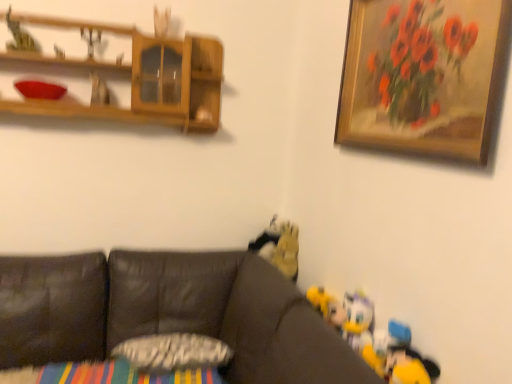
Identify the location of wooden shelf at upper left. (140, 78).

What do you see at coordinates (140, 78) in the screenshot?
I see `wooden shelf at upper left` at bounding box center [140, 78].

This screenshot has height=384, width=512. In order to click on matte plastic toy at upper left, which appears as the 5th toy when ordered from the bottom in this screenshot , I will do `click(91, 40)`.

The height and width of the screenshot is (384, 512). What do you see at coordinates (279, 247) in the screenshot? I see `fluffy yellow toy at center, which is the fourth toy from left to right` at bounding box center [279, 247].

At what (x,y) coordinates should I click in order to perform the action: click on brown leather couch at lower left. Please return your answer as a coordinate pair (x, y). Looking at the image, I should click on (169, 313).

The height and width of the screenshot is (384, 512). What do you see at coordinates (406, 358) in the screenshot?
I see `yellow plush toy at lower right, arranged as the 1th toy when viewed from the right` at bounding box center [406, 358].

Find the location of a particular element. The height and width of the screenshot is (384, 512). yellow plush toy at lower right, which is counted as the 6th toy, starting from the left is located at coordinates (406, 358).

Identify the location of metallic silver toy at upper left, marked as the 4th toy in a bottom-to-top arrangement. This screenshot has width=512, height=384. (99, 91).

Find the location of a particular element. This screenshot has width=512, height=384. wooden shelf at upper left is located at coordinates (140, 78).

From the image's perspective, would you say plush yellow duck at lower right, the 2th toy positioned from the right, is positioned over fluffy yellow toy at center, which is counted as the 6th toy, starting from the front?

No.

Is fluffy yellow toy at center, which is counted as the 6th toy, starting from the front, a part of plush yellow duck at lower right, which is the 5th toy in left-to-right order?

Actually, fluffy yellow toy at center, which is counted as the 6th toy, starting from the front, is outside plush yellow duck at lower right, which is the 5th toy in left-to-right order.

Visually, is plush yellow duck at lower right, positioned as the second toy in front-to-back order, positioned to the left or to the right of fluffy yellow toy at center, which is counted as the 6th toy, starting from the front?

In the image, plush yellow duck at lower right, positioned as the second toy in front-to-back order, appears on the right side of fluffy yellow toy at center, which is counted as the 6th toy, starting from the front.

Considering the sizes of matte plastic toy at upper left, marked as the 3th toy in a back-to-front arrangement, and wooden shelf at upper left in the image, is matte plastic toy at upper left, marked as the 3th toy in a back-to-front arrangement, bigger or smaller than wooden shelf at upper left?

Clearly, matte plastic toy at upper left, marked as the 3th toy in a back-to-front arrangement, is smaller in size than wooden shelf at upper left.

Considering the relative positions of matte plastic toy at upper left, the 4th toy viewed from the front, and wooden shelf at upper left in the image provided, is matte plastic toy at upper left, the 4th toy viewed from the front, to the left or to the right of wooden shelf at upper left?

matte plastic toy at upper left, the 4th toy viewed from the front, is positioned on wooden shelf at upper left's left side.

Considering the points (92, 48) and (47, 19), which point is in front, point (92, 48) or point (47, 19)?

The point (47, 19) is closer to the camera.

Which object is closer to the camera taking this photo, matte plastic toy at upper left, marked as the 3th toy in a back-to-front arrangement, or brown leather couch at lower left?

Positioned in front is brown leather couch at lower left.

From a real-world perspective, who is located lower, matte plastic toy at upper left, marked as the 3th toy in a back-to-front arrangement, or brown leather couch at lower left?

From a 3D spatial view, brown leather couch at lower left is below.

Considering the sizes of objects matte plastic toy at upper left, marked as the 3th toy in a back-to-front arrangement, and brown leather couch at lower left in the image provided, who is shorter, matte plastic toy at upper left, marked as the 3th toy in a back-to-front arrangement, or brown leather couch at lower left?

Standing shorter between the two is matte plastic toy at upper left, marked as the 3th toy in a back-to-front arrangement.

Is the surface of matte plastic toy at upper left, the second toy positioned from the top, in direct contact with brown leather couch at lower left?

No, matte plastic toy at upper left, the second toy positioned from the top, is not touching brown leather couch at lower left.

Is green felt toy at upper left, arranged as the 1th toy when viewed from the top, facing towards plush yellow duck at lower right, the second toy when ordered from bottom to top?

No, green felt toy at upper left, arranged as the 1th toy when viewed from the top, is not oriented towards plush yellow duck at lower right, the second toy when ordered from bottom to top.

Could you measure the distance between green felt toy at upper left, the third toy in the front-to-back sequence, and plush yellow duck at lower right, positioned as the second toy in front-to-back order?

6.05 feet.

Is green felt toy at upper left, the fourth toy from the back, next to plush yellow duck at lower right, which is the 5th toy in left-to-right order, and touching it?

No, green felt toy at upper left, the fourth toy from the back, is not making contact with plush yellow duck at lower right, which is the 5th toy in left-to-right order.

From the picture: Can you confirm if green felt toy at upper left, the third toy in the front-to-back sequence, is taller than plush yellow duck at lower right, the 2th toy positioned from the right?

No.

From a real-world perspective, is brown leather couch at lower left positioned above or below metallic silver toy at upper left, the fifth toy when ordered from front to back?

brown leather couch at lower left is situated lower than metallic silver toy at upper left, the fifth toy when ordered from front to back, in the real world.

Considering the relative sizes of brown leather couch at lower left and metallic silver toy at upper left, marked as the 4th toy in a bottom-to-top arrangement, in the image provided, is brown leather couch at lower left bigger than metallic silver toy at upper left, marked as the 4th toy in a bottom-to-top arrangement,?

Correct, brown leather couch at lower left is larger in size than metallic silver toy at upper left, marked as the 4th toy in a bottom-to-top arrangement.

Is point (356, 358) in front of point (96, 88)?

Yes, it is.

Between yellow plush toy at lower right, the first toy viewed from the front, and matte plastic toy at upper left, the 4th toy viewed from the front, which one is positioned in front?

yellow plush toy at lower right, the first toy viewed from the front, is closer to the camera.

Would you say matte plastic toy at upper left, which appears as the 5th toy when ordered from the bottom, is part of yellow plush toy at lower right, the 1th toy when ordered from bottom to top,'s contents?

Definitely not — matte plastic toy at upper left, which appears as the 5th toy when ordered from the bottom, is not inside yellow plush toy at lower right, the 1th toy when ordered from bottom to top.

Is yellow plush toy at lower right, arranged as the 1th toy when viewed from the right, aimed at matte plastic toy at upper left, marked as the 3th toy in a back-to-front arrangement?

No, yellow plush toy at lower right, arranged as the 1th toy when viewed from the right, is not facing towards matte plastic toy at upper left, marked as the 3th toy in a back-to-front arrangement.

Can you confirm if brown leather couch at lower left is positioned to the left of plush yellow duck at lower right, positioned as the second toy in front-to-back order?

Correct, you'll find brown leather couch at lower left to the left of plush yellow duck at lower right, positioned as the second toy in front-to-back order.

Is there a large distance between brown leather couch at lower left and plush yellow duck at lower right, the 5th toy positioned from the back?

No, brown leather couch at lower left is not far from plush yellow duck at lower right, the 5th toy positioned from the back.

Is the depth of brown leather couch at lower left greater than that of plush yellow duck at lower right, the 2th toy positioned from the right?

That is False.

From a real-world perspective, is brown leather couch at lower left physically located above or below plush yellow duck at lower right, the 5th toy positioned from the back?

brown leather couch at lower left is situated lower than plush yellow duck at lower right, the 5th toy positioned from the back, in the real world.

From the image's perspective, starting from the fluffy yellow toy at center, the third toy positioned from the right, which toy is the 1st one below? Please provide its 2D coordinates.

[(358, 320)]

Where is `shelf on the right of matte plastic toy at upper left, the second toy viewed from the left`? shelf on the right of matte plastic toy at upper left, the second toy viewed from the left is located at coordinates (140, 78).

Which object lies further to the anchor point matte plastic toy at upper left, the second toy positioned from the top, green felt toy at upper left, acting as the first toy starting from the left, or yellow plush toy at lower right, the 6th toy positioned from the top?

yellow plush toy at lower right, the 6th toy positioned from the top, is positioned further to the anchor matte plastic toy at upper left, the second toy positioned from the top.

Estimate the real-world distances between objects in this image. Which object is further from yellow plush toy at lower right, the 6th toy positioned from the top, textured gray pillow at center or green felt toy at upper left, acting as the first toy starting from the left?

Among the two, green felt toy at upper left, acting as the first toy starting from the left, is located further to yellow plush toy at lower right, the 6th toy positioned from the top.

Estimate the real-world distances between objects in this image. Which object is further from yellow plush toy at lower right, the first toy viewed from the front, wooden framed painting at upper right or textured gray pillow at center?

textured gray pillow at center is further to yellow plush toy at lower right, the first toy viewed from the front.

Considering their positions, is wooden shelf at upper left positioned closer to yellow plush toy at lower right, the first toy viewed from the front, than brown leather couch at lower left?

brown leather couch at lower left is positioned closer to the anchor yellow plush toy at lower right, the first toy viewed from the front.

Considering their positions, is yellow plush toy at lower right, the first toy viewed from the front, positioned further to metallic silver toy at upper left, the fifth toy when ordered from front to back, than plush yellow duck at lower right, which is the fifth toy from top to bottom?

Among the two, yellow plush toy at lower right, the first toy viewed from the front, is located further to metallic silver toy at upper left, the fifth toy when ordered from front to back.

When comparing their distances from wooden shelf at upper left, does yellow plush toy at lower right, arranged as the 1th toy when viewed from the right, or fluffy yellow toy at center, the third toy positioned from the right, seem further?

yellow plush toy at lower right, arranged as the 1th toy when viewed from the right, is further to wooden shelf at upper left.

When comparing their distances from brown leather couch at lower left, does fluffy yellow toy at center, the third toy from the bottom, or metallic silver toy at upper left, marked as the 4th toy in a bottom-to-top arrangement, seem closer?

fluffy yellow toy at center, the third toy from the bottom, is positioned closer to the anchor brown leather couch at lower left.

From the image, which object appears to be nearer to metallic silver toy at upper left, the 3th toy from the left, matte plastic toy at upper left, which appears as the 5th toy when ordered from the bottom, or wooden framed painting at upper right?

Among the two, matte plastic toy at upper left, which appears as the 5th toy when ordered from the bottom, is located nearer to metallic silver toy at upper left, the 3th toy from the left.

You are a GUI agent. You are given a task and a screenshot of the screen. Output one action in this format:
    pyautogui.click(x=<x>, y=<y>)
    Task: Click on the toy between metallic silver toy at upper left, marked as the 4th toy in a bottom-to-top arrangement, and plush yellow duck at lower right, positioned as the second toy in front-to-back order, in the horizontal direction
    This screenshot has width=512, height=384.
    Given the screenshot: What is the action you would take?
    coord(279,247)

In order to click on pillow positioned between yellow plush toy at lower right, the 6th toy positioned from the top, and fluffy yellow toy at center, which appears as the 4th toy when viewed from the top, from near to far in this screenshot , I will do `click(173, 352)`.

You are a GUI agent. You are given a task and a screenshot of the screen. Output one action in this format:
    pyautogui.click(x=<x>, y=<y>)
    Task: Click on the picture frame between metallic silver toy at upper left, marked as the 4th toy in a bottom-to-top arrangement, and textured gray pillow at center from top to bottom
    
    Given the screenshot: What is the action you would take?
    pyautogui.click(x=422, y=76)

The width and height of the screenshot is (512, 384). Identify the location of shelf between wooden framed painting at upper right and fluffy yellow toy at center, which appears as the first toy when viewed from the back, along the z-axis. tap(140, 78).